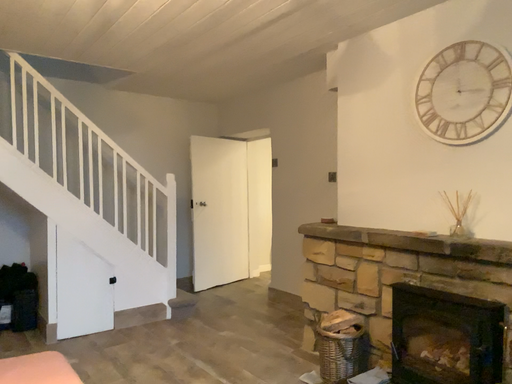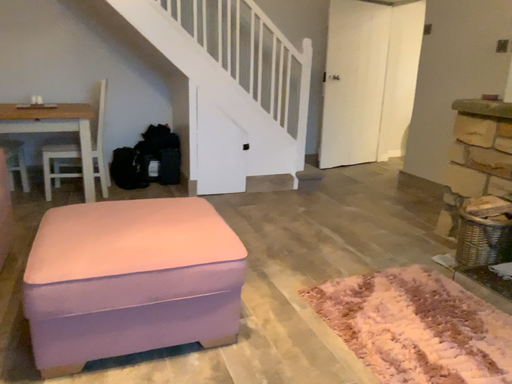
Question: Which way did the camera rotate in the video?

Choices:
 (A) rotated left
 (B) rotated right

Answer: (A)